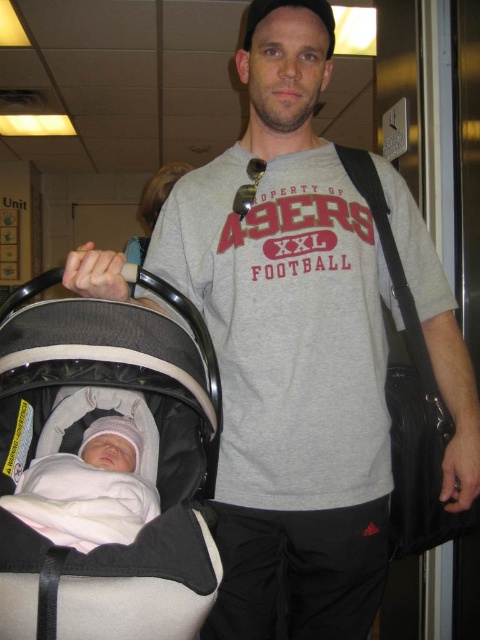
Is beige fabric baby carriage at center positioned before soft pink fabric at center?

Yes, it is.

Is beige fabric baby carriage at center shorter than soft pink fabric at center?

No, beige fabric baby carriage at center is not shorter than soft pink fabric at center.

Does point (103, 572) come closer to viewer compared to point (131, 541)?

Yes, it is.

Identify the location of beige fabric baby carriage at center. The height and width of the screenshot is (640, 480). (140, 465).